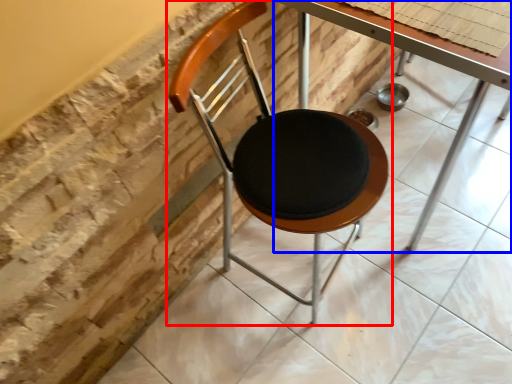
Question: Which object appears farthest to the camera in this image, chair (highlighted by a red box) or table (highlighted by a blue box)?

Choices:
 (A) chair
 (B) table

Answer: (B)